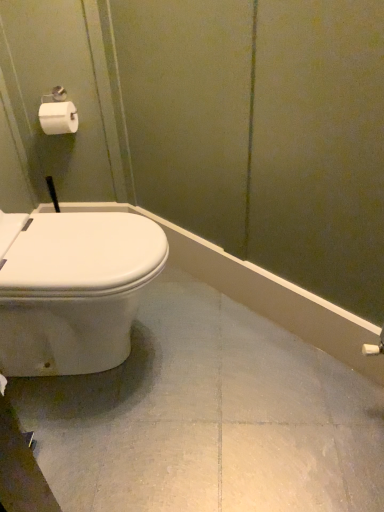
Question: Are white matte toilet paper at upper left and white glossy toilet at left making contact?

Choices:
 (A) yes
 (B) no

Answer: (B)

Question: Is white matte toilet paper at upper left far away from white glossy toilet at left?

Choices:
 (A) no
 (B) yes

Answer: (A)

Question: Is white matte toilet paper at upper left positioned behind white glossy toilet at left?

Choices:
 (A) yes
 (B) no

Answer: (A)

Question: Is white matte toilet paper at upper left in front of white glossy toilet at left?

Choices:
 (A) yes
 (B) no

Answer: (B)

Question: From a real-world perspective, is white matte toilet paper at upper left under white glossy toilet at left?

Choices:
 (A) yes
 (B) no

Answer: (B)

Question: Is white matte toilet paper at upper left bigger than white glossy toilet at left?

Choices:
 (A) no
 (B) yes

Answer: (A)

Question: From a real-world perspective, is white glossy toilet at left under white matte toilet paper at upper left?

Choices:
 (A) yes
 (B) no

Answer: (A)

Question: Is white glossy toilet at left bigger than white matte toilet paper at upper left?

Choices:
 (A) no
 (B) yes

Answer: (B)

Question: Does white glossy toilet at left turn towards white matte toilet paper at upper left?

Choices:
 (A) no
 (B) yes

Answer: (A)

Question: Considering the relative sizes of white glossy toilet at left and white matte toilet paper at upper left in the image provided, is white glossy toilet at left shorter than white matte toilet paper at upper left?

Choices:
 (A) no
 (B) yes

Answer: (A)

Question: Is white glossy toilet at left outside white matte toilet paper at upper left?

Choices:
 (A) yes
 (B) no

Answer: (A)

Question: Is white glossy toilet at left smaller than white matte toilet paper at upper left?

Choices:
 (A) no
 (B) yes

Answer: (A)

Question: From the image's perspective, is white glossy toilet at left positioned above or below white matte toilet paper at upper left?

Choices:
 (A) above
 (B) below

Answer: (B)